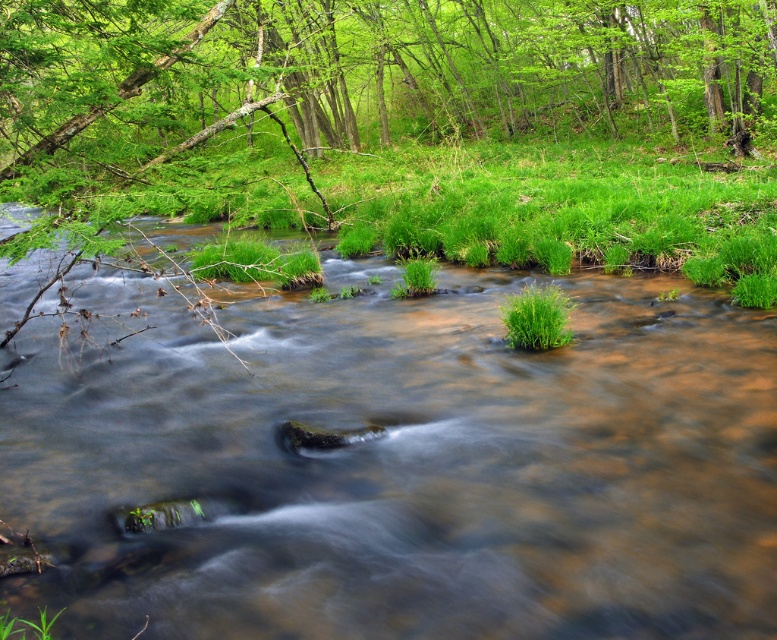
Does brown muddy stream at center appear over green leafy tree at upper center?

Actually, brown muddy stream at center is below green leafy tree at upper center.

Who is positioned more to the left, brown muddy stream at center or green leafy tree at upper center?

From the viewer's perspective, brown muddy stream at center appears more on the left side.

Locate an element on the screen. The height and width of the screenshot is (640, 777). brown muddy stream at center is located at coordinates (394, 460).

Can you confirm if green leafy tree at upper center is thinner than green leafy grass at center?

In fact, green leafy tree at upper center might be wider than green leafy grass at center.

Locate an element on the screen. The image size is (777, 640). green leafy tree at upper center is located at coordinates (403, 129).

How far apart are brown muddy stream at center and green leafy grass at center?

They are 2.29 meters apart.

Which is behind, point (584, 397) or point (511, 304)?

Point (511, 304)

Between point (636, 452) and point (563, 304), which one is positioned in front?

Point (636, 452)

Locate an element on the screen. The width and height of the screenshot is (777, 640). brown muddy stream at center is located at coordinates (394, 460).